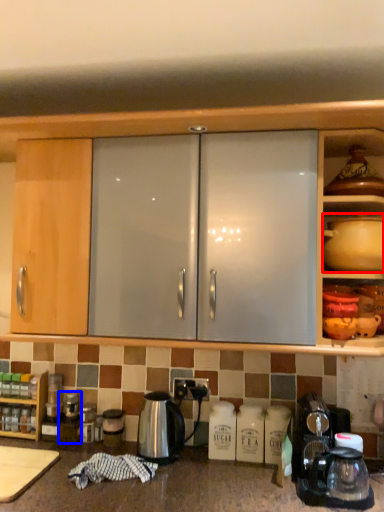
Question: Which of the following is the farthest to the observer, coffeepot (highlighted by a red box) or appliance (highlighted by a blue box)?

Choices:
 (A) coffeepot
 (B) appliance

Answer: (B)